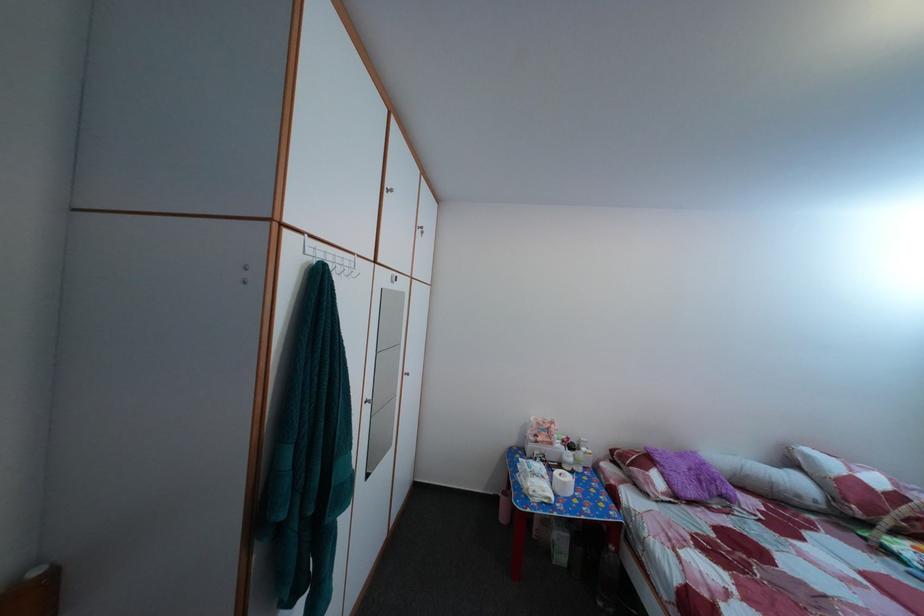
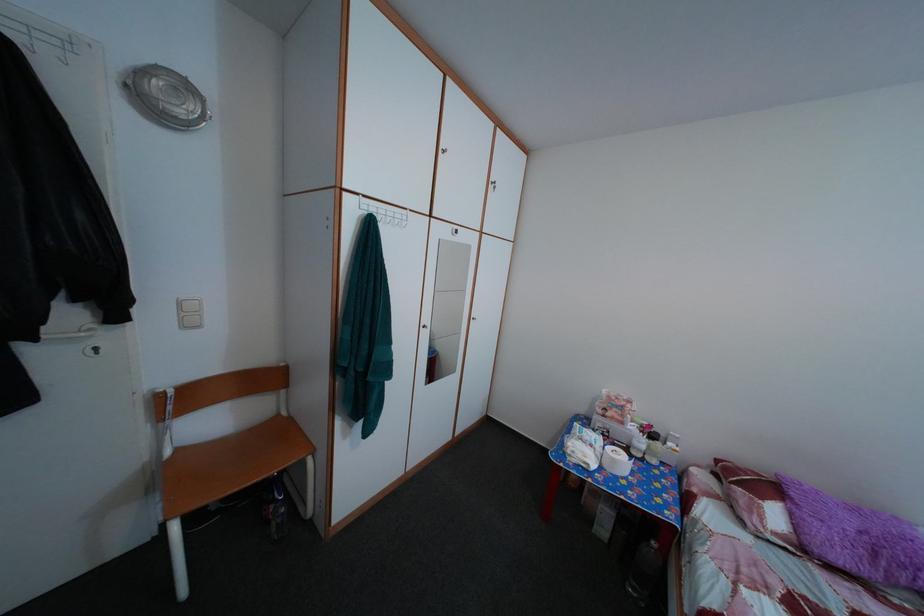
Question: How did the camera likely rotate?

Choices:
 (A) Left
 (B) Right
 (C) Up
 (D) Down

Answer: (A)